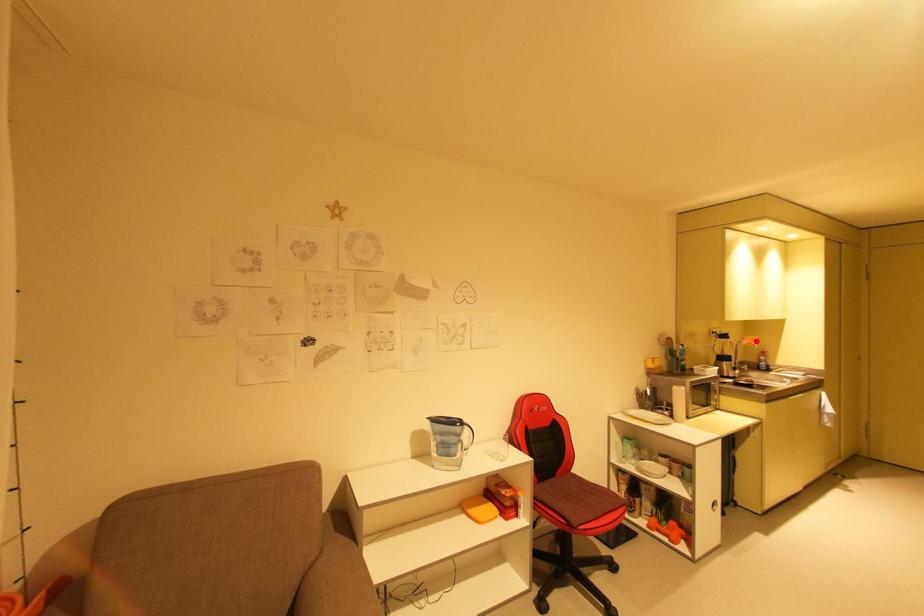
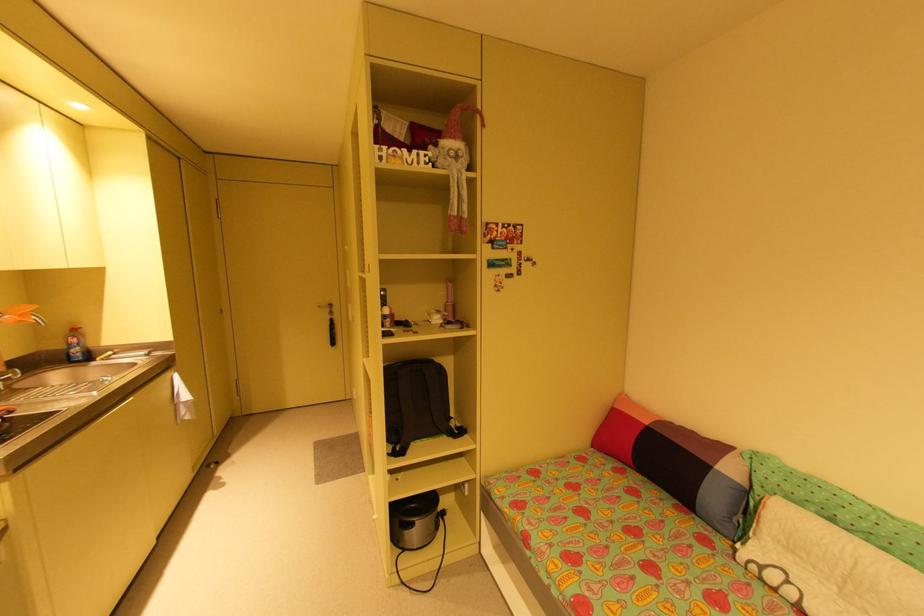
Where in the second image is the point corresponding to the highlighted location from the first image?

(25, 315)